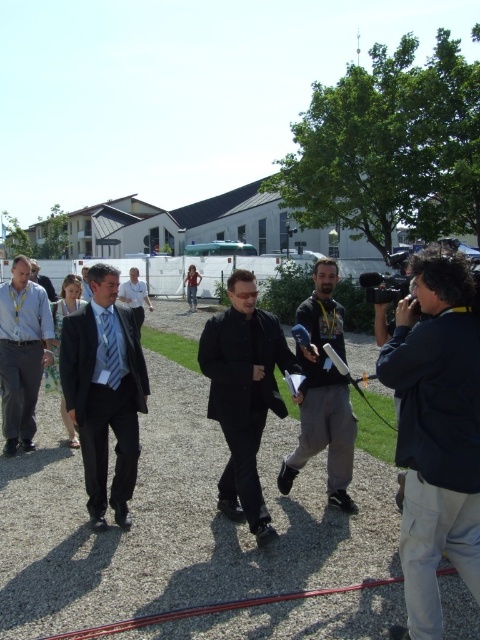
Can you confirm if dark blue jacket at right is positioned below light blue suit at center?

Indeed, dark blue jacket at right is positioned under light blue suit at center.

Find the location of `dark blue jacket at right`. dark blue jacket at right is located at coordinates (435, 433).

Can you confirm if matte black suit at left is positioned above striped fabric tie at center?

No.

What are the coordinates of `matte black suit at left` in the screenshot? It's located at point(105,392).

Does point (99, 292) come closer to viewer compared to point (108, 346)?

No, (99, 292) is behind (108, 346).

Locate an element on the screen. This screenshot has height=640, width=480. matte black suit at left is located at coordinates (105, 392).

Can you confirm if black matte jacket at center is shorter than light blue suit at center?

No.

Is point (272, 378) positioned behind point (40, 280)?

No.

I want to click on black matte jacket at center, so click(243, 394).